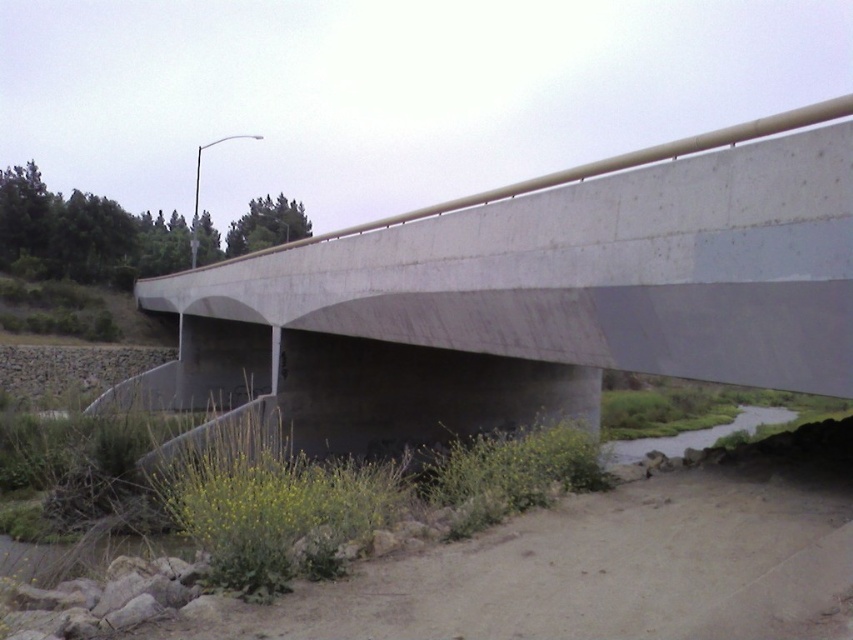
You are a hiker carrying a backpack and need to cross the bridge. Is the concrete bridge at center high enough to allow you to pass underneath it while walking towards the green grassy river at lower right?

The concrete bridge at center has a greater height compared to the green grassy river at lower right, so yes, the bridge is high enough for you to pass underneath it while walking towards the green grassy river at lower right.